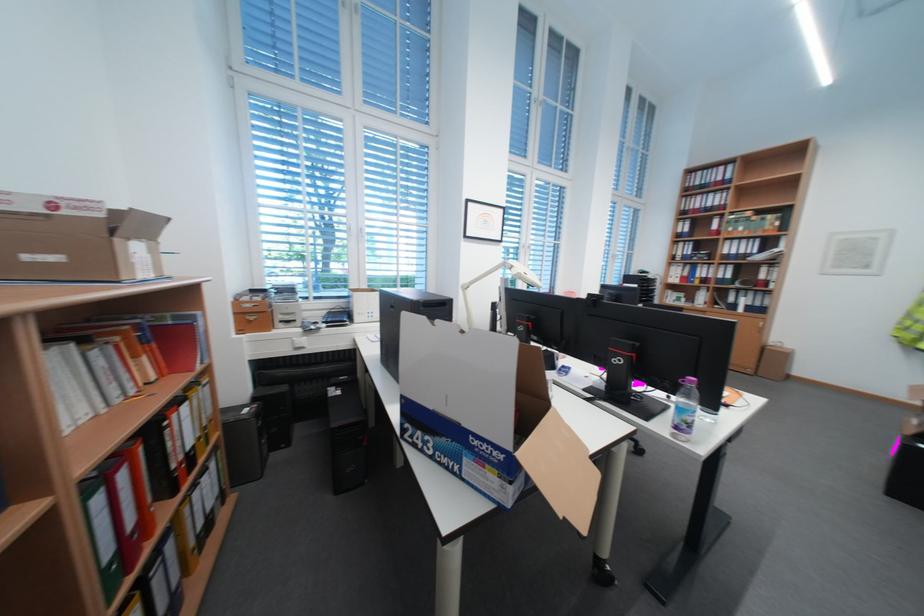
Find where to pull the drawer handle. Please return your answer as a coordinate pair (x, y).

(760, 326)